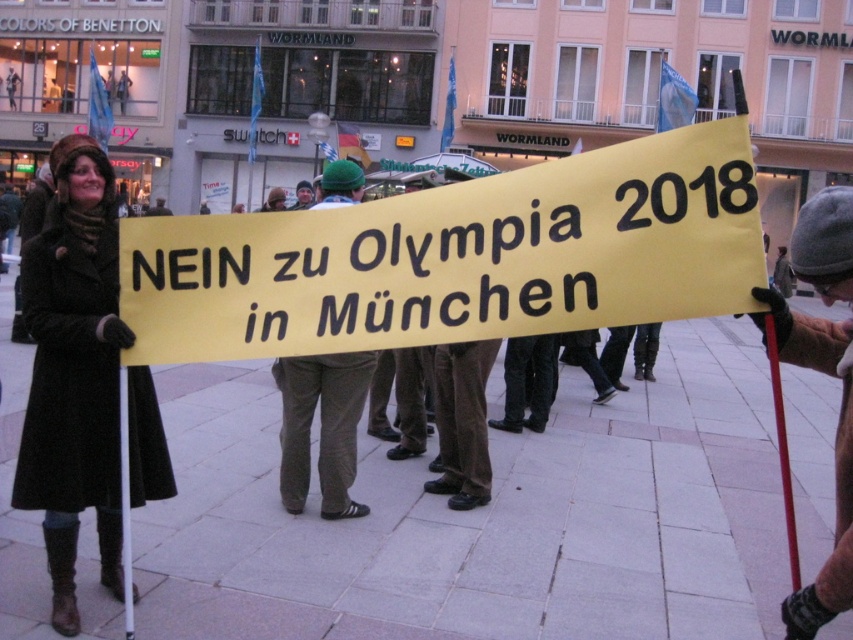
From the picture: Where is the matte black coat at left located in the image?

The matte black coat at left is located at point 0.583 in the x coordinate and 0.087 in the y coordinate.

You are a photographer trying to capture the protest scene. You notice the matte black coat at left and the khaki corduroy pants at center. Which clothing item is positioned higher in the image?

The matte black coat at left is above the khaki corduroy pants at center, so the matte black coat at left is positioned higher in the image.

You are a photographer trying to capture a clear shot of the khaki corduroy pants at center and the matte black coat at left. Since you want to ensure both are visible in the frame, which clothing item should you focus on first to account for their sizes?

The matte black coat at left is taller than the khaki corduroy pants at center, so you should focus on the matte black coat at left first to ensure its full height is captured before adjusting the frame for the shorter khaki corduroy pants at center.